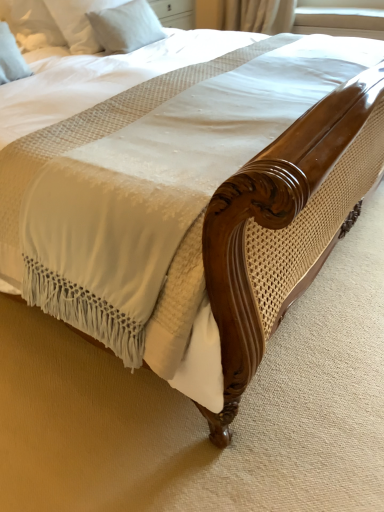
Question: Is white soft pillow at upper left, marked as the 2th pillow in a left-to-right arrangement, situated inside white fabric at upper right or outside?

Choices:
 (A) inside
 (B) outside

Answer: (B)

Question: Visually, is white soft pillow at upper left, acting as the first pillow starting from the right, positioned to the left or to the right of white fabric at upper right?

Choices:
 (A) right
 (B) left

Answer: (B)

Question: Based on their relative distances, which object is farther from the white fabric at upper right?

Choices:
 (A) white soft pillow at upper left, positioned as the 2th pillow in right-to-left order
 (B) white soft pillow at upper left, marked as the 2th pillow in a left-to-right arrangement

Answer: (A)

Question: Considering the real-world distances, which object is farthest from the white fabric at upper right?

Choices:
 (A) white soft pillow at upper left, the first pillow from the back
 (B) white soft pillow at upper left, positioned as the 2th pillow in right-to-left order

Answer: (B)